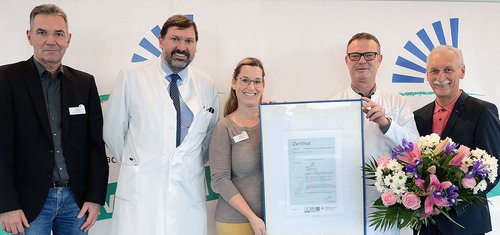
Where is `wall image`? wall image is located at coordinates (142, 45), (403, 67), (111, 192), (103, 95).